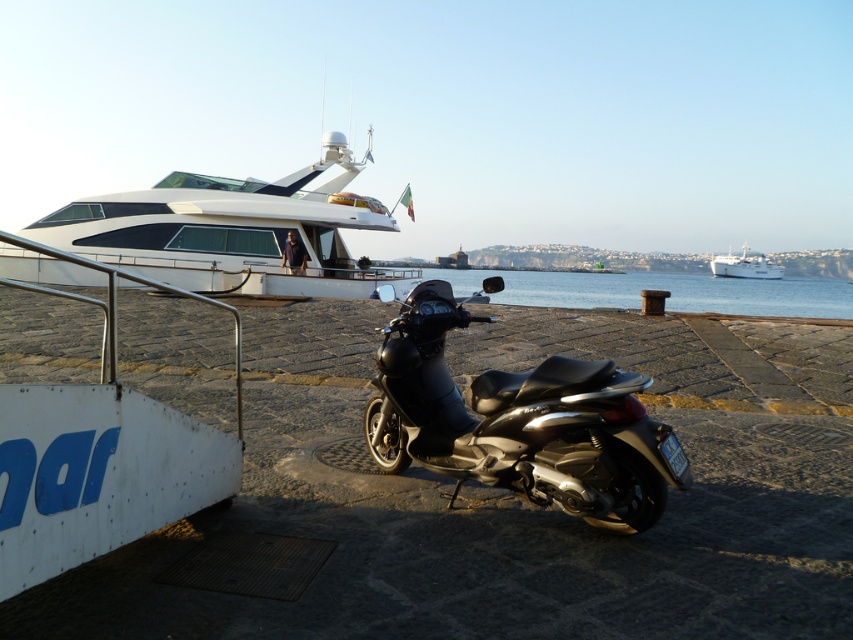
Question: Which point is farther to the camera?

Choices:
 (A) white glossy yacht at upper left
 (B) blue water at center

Answer: (B)

Question: In this image, where is white glossy yacht at upper left located relative to white glossy boat at upper right?

Choices:
 (A) right
 (B) left

Answer: (B)

Question: Which point is closer to the camera?

Choices:
 (A) (747, 268)
 (B) (491, 448)
 (C) (322, 157)

Answer: (B)

Question: Does white glossy yacht at upper left appear on the left side of white glossy boat at upper right?

Choices:
 (A) no
 (B) yes

Answer: (B)

Question: Is white glossy yacht at upper left closer to the viewer compared to white glossy boat at upper right?

Choices:
 (A) no
 (B) yes

Answer: (B)

Question: Which point is farther to the camera?

Choices:
 (A) blue water at center
 (B) white glossy yacht at upper left
 (C) white glossy boat at upper right
 (D) shiny black scooter at center

Answer: (C)